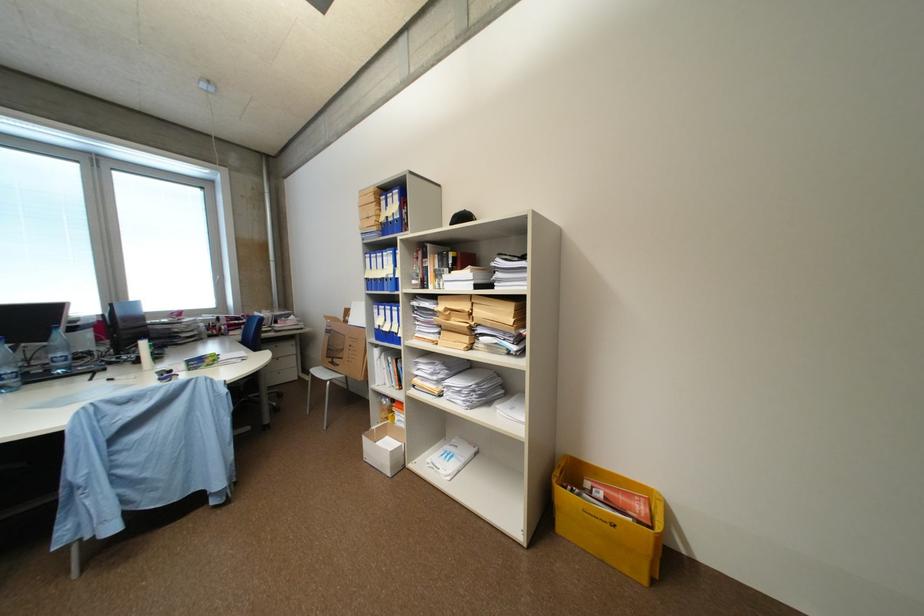
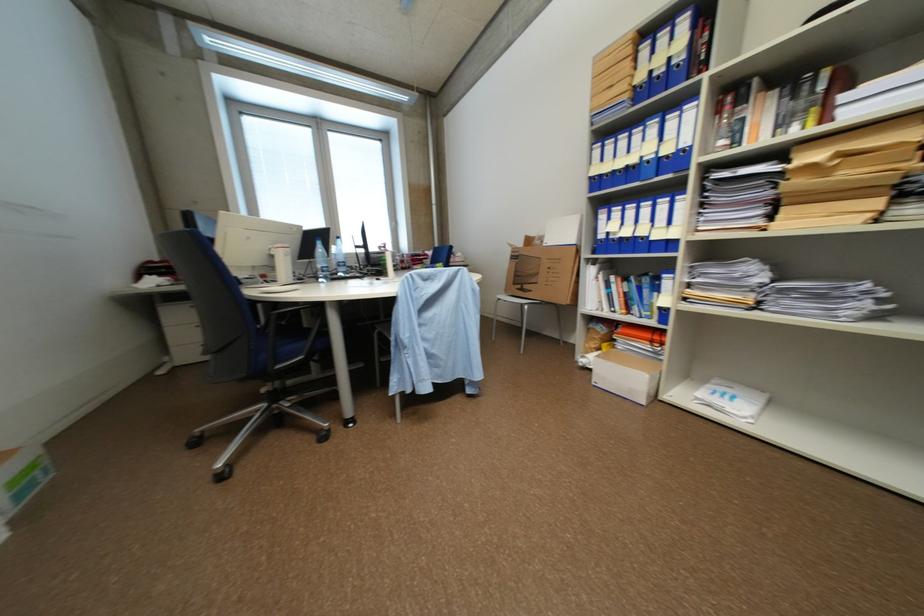
Locate, in the second image, the point that corresponds to point 375,280 in the first image.

(600, 180)